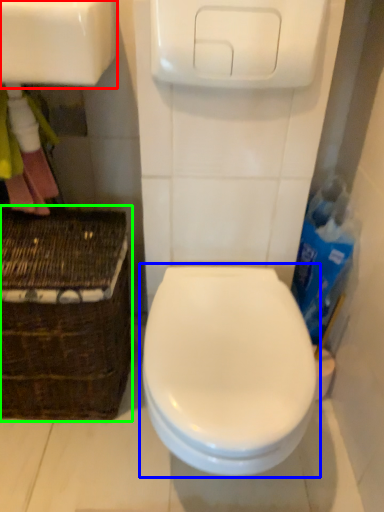
Question: Which object is the closest to the sink (highlighted by a red box)? Choose among these: toilet (highlighted by a blue box) or basket (highlighted by a green box).

Choices:
 (A) toilet
 (B) basket

Answer: (B)